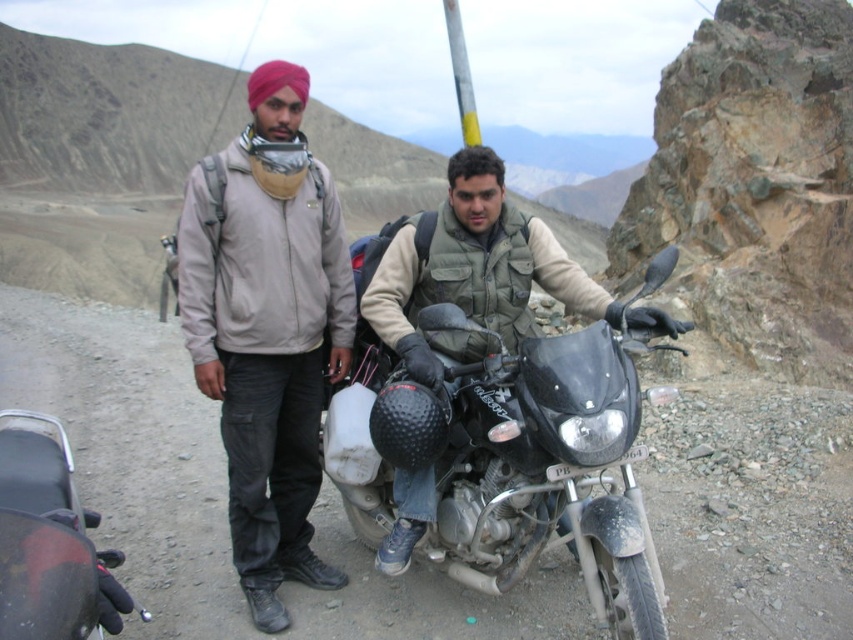
You are a photographer trying to capture a clear shot of both the matte khaki jacket at center and the beige fabric headscarf at center. Since you want both subjects in focus, which object should you adjust your camera focus on first to ensure the other is also in the depth of field?

The matte khaki jacket at center is closer to the viewer than the beige fabric headscarf at center. To ensure both are in focus, you should focus on the beige fabric headscarf at center, as it is farther away. This way, the closer matte khaki jacket will still be within the depth of field.

Consider the image. You are a photographer trying to capture a portrait of the two travelers. You notice the matte khaki jacket at center and the beige fabric headscarf at center in your frame. Which clothing item is positioned more to the left side of the frame?

The matte khaki jacket at center is positioned more to the left side of the frame compared to the beige fabric headscarf at center.